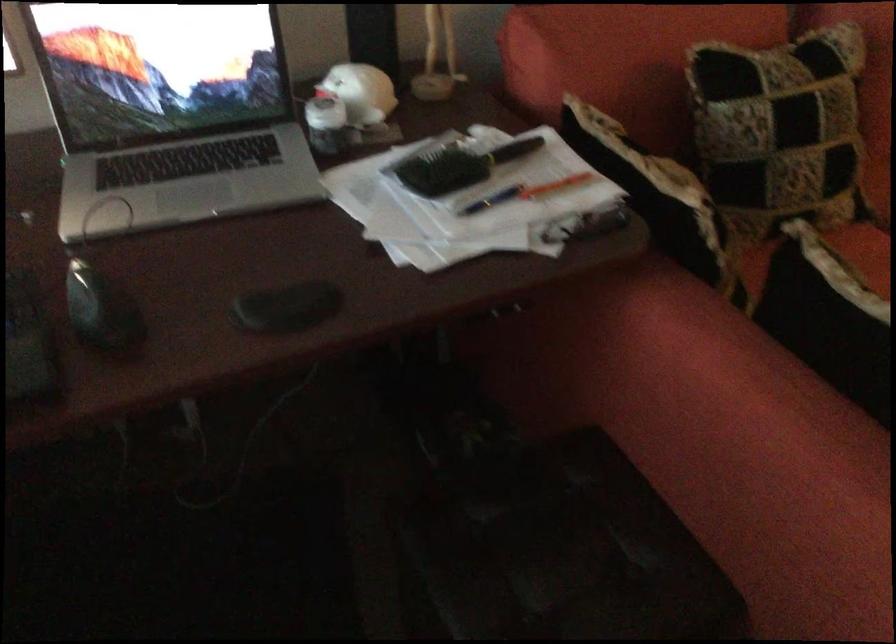
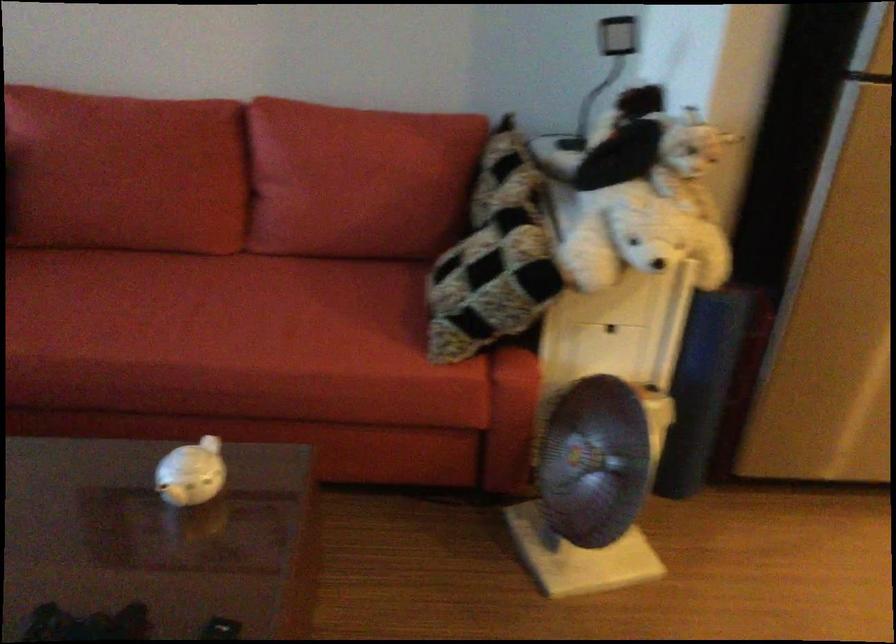
Question: The images are taken continuously from a first-person perspective. In which direction are you moving?

Choices:
 (A) Left
 (B) Right
 (C) Forward
 (D) Backward

Answer: (B)